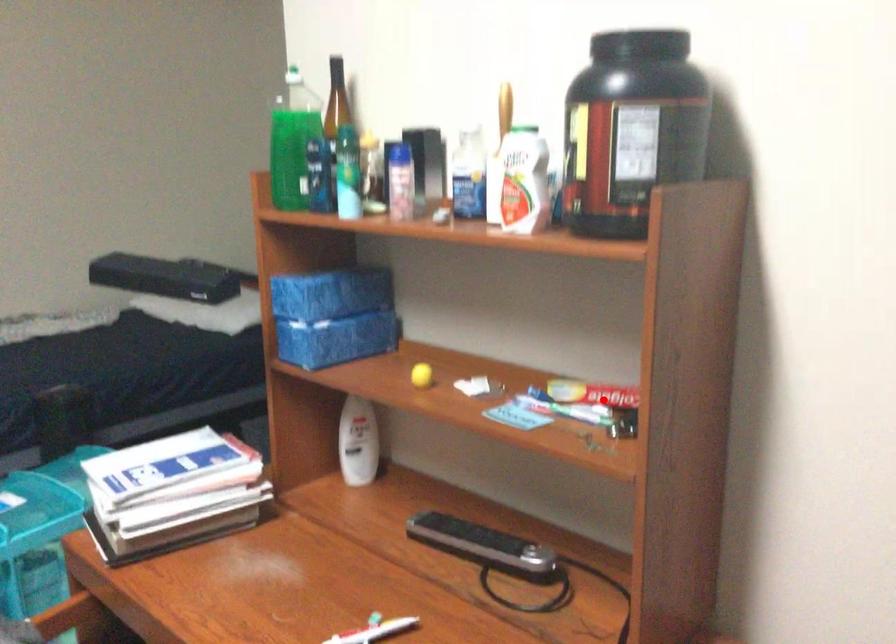
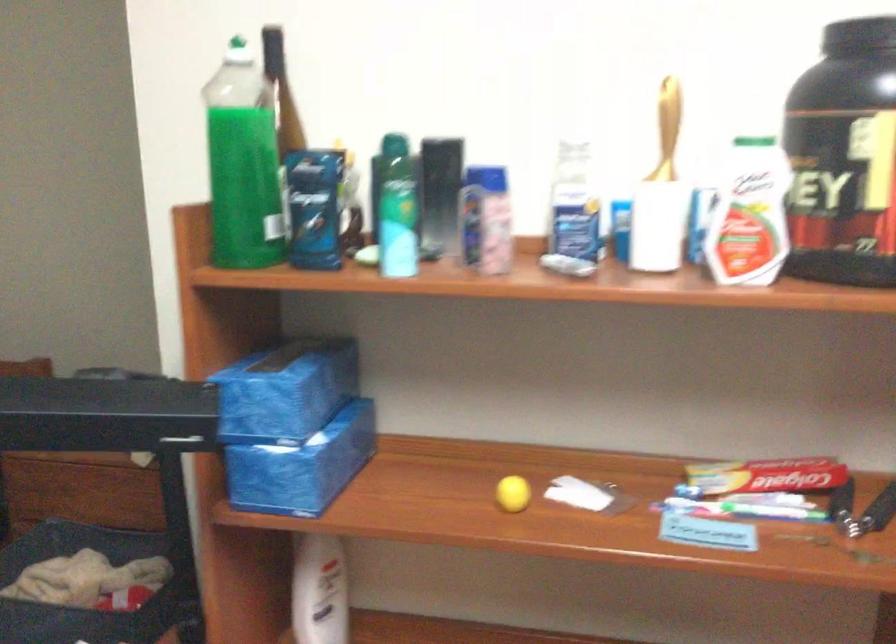
Question: I am providing you with two images of the same scene from different viewpoints. A red point is shown in image1. For the corresponding object point in image2, is it positioned nearer or farther from the camera?

Choices:
 (A) Nearer
 (B) Farther

Answer: (A)